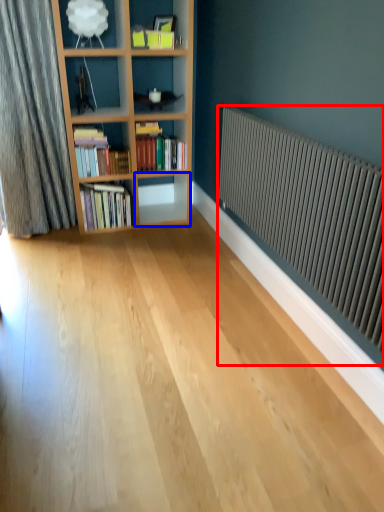
Question: Among these objects, which one is nearest to the camera, radiator (highlighted by a red box) or shelf (highlighted by a blue box)?

Choices:
 (A) radiator
 (B) shelf

Answer: (A)